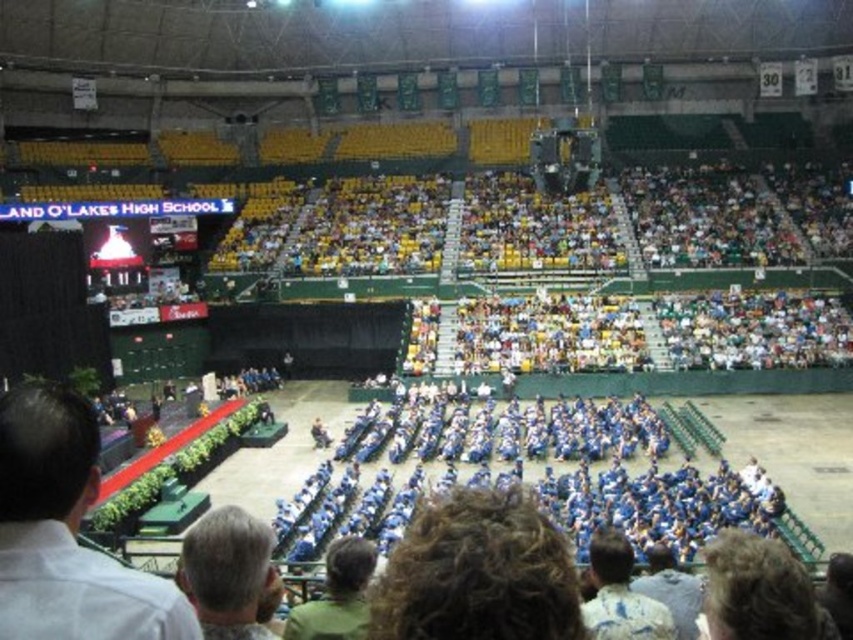
You are standing at the center of the arena and want to find the white shirt at lower left. According to the coordinate system where the bottom left corner is the origin, which direction should you look to see the point at (67, 532) on the white shirt at lower left?

The point at (67, 532) on the white shirt at lower left is located at the lower left area of the image. Since you are at the center of the arena, you should look towards the lower left direction to see it.

You are attending the graduation ceremony at Land O Lakes High School and notice two people on the stage. One is wearing a white shirt at lower left and the other has dark brown hair at lower right. Which of these two people is closer to the front of the stage?

The white shirt at lower left is shorter than dark brown hair at lower right, so the white shirt at lower left is closer to the front of the stage.

You are a photographer at the graduation ceremony. You need to capture a photo of both the white shirt at lower left and the dark brown hair at lower right. Based on their positions, which one should you focus on first to ensure both are in frame?

The white shirt at lower left is to the left of dark brown hair at lower right, so you should focus on the white shirt at lower left first to ensure both are in frame.